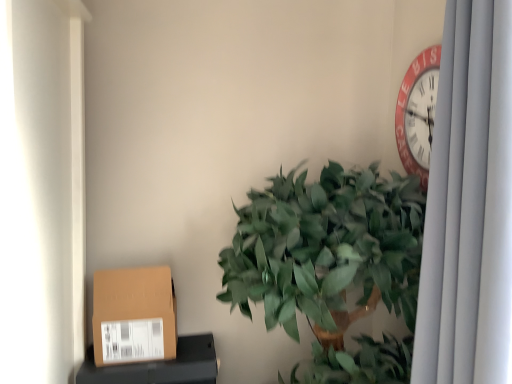
Find the location of `vacant space situated above brown cardboard box at lower left (from a real-world perspective)`. vacant space situated above brown cardboard box at lower left (from a real-world perspective) is located at coordinates (159, 347).